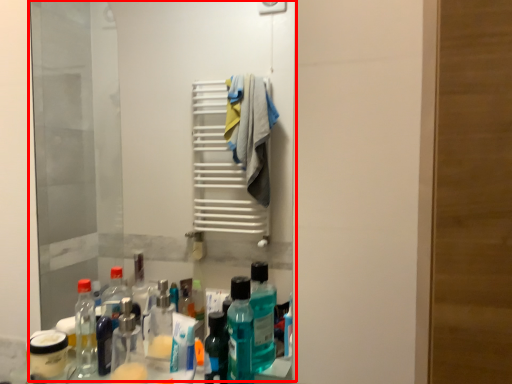
Question: From the image's perspective, where is mirror (annotated by the red box) located in relation to bottle in the image?

Choices:
 (A) below
 (B) above

Answer: (B)